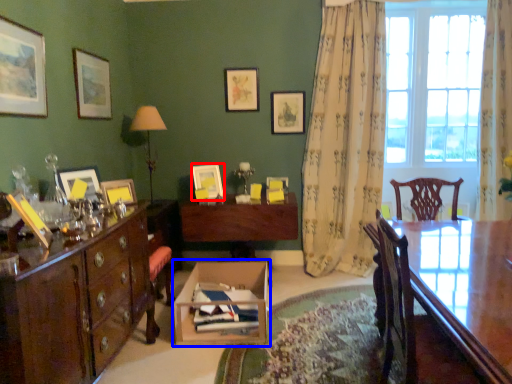
Question: Which of the following is the closest to the observer, picture frame (highlighted by a red box) or cardboard box (highlighted by a blue box)?

Choices:
 (A) picture frame
 (B) cardboard box

Answer: (B)